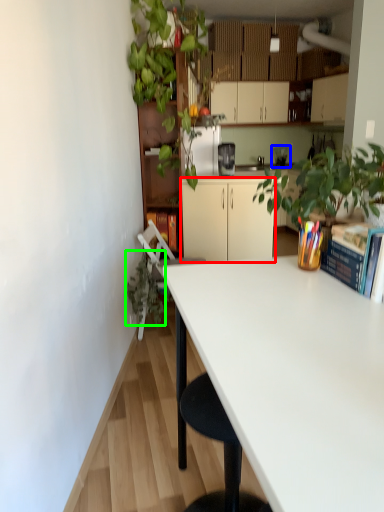
Question: Which object is the closest to the cabinetry (highlighted by a red box)? Choose among these: appliance (highlighted by a blue box) or vegetation (highlighted by a green box).

Choices:
 (A) appliance
 (B) vegetation

Answer: (B)